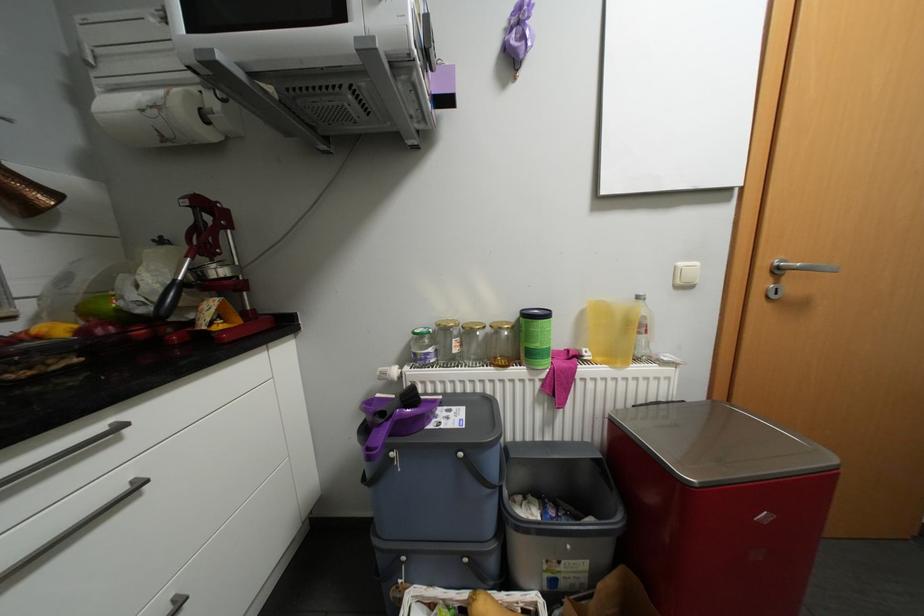
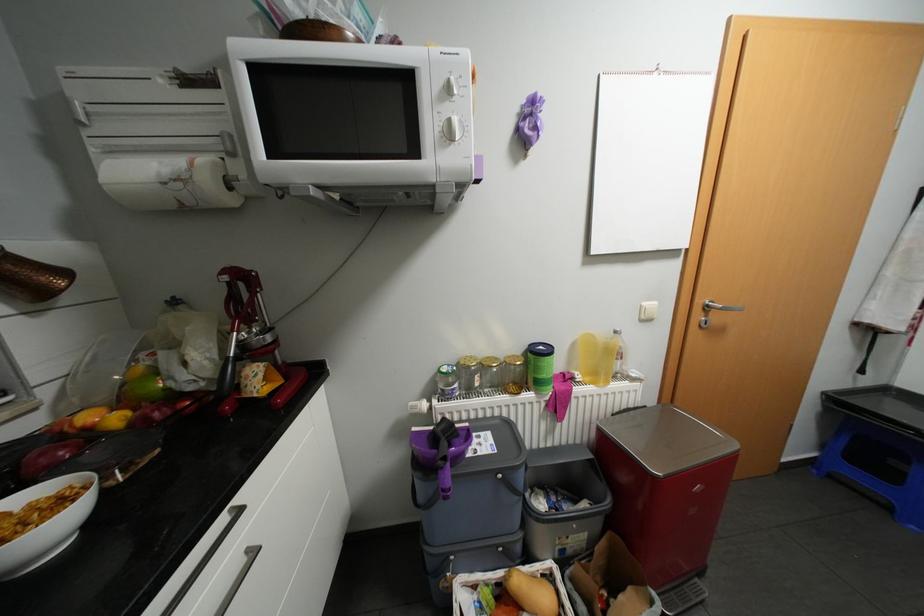
Find the pixel in the second image that matches the point at 141,480 in the first image.

(256, 549)